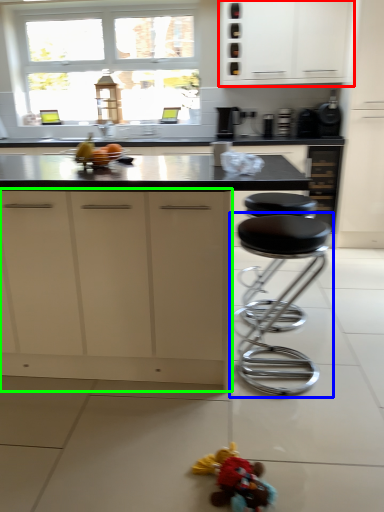
Question: Considering the real-world distances, which object is closest to cabinetry (highlighted by a red box)? stool (highlighted by a blue box) or cabinetry (highlighted by a green box).

Choices:
 (A) stool
 (B) cabinetry

Answer: (A)